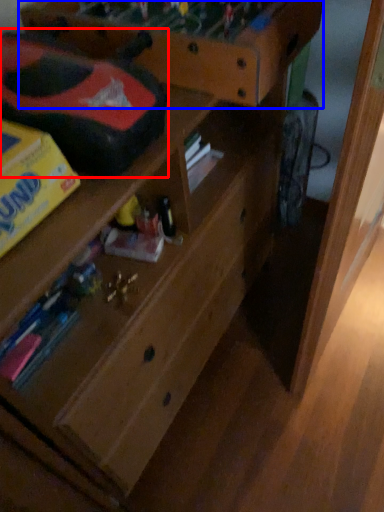
Question: Which object is closer to the camera taking this photo, toy car (highlighted by a red box) or shelf (highlighted by a blue box)?

Choices:
 (A) toy car
 (B) shelf

Answer: (A)